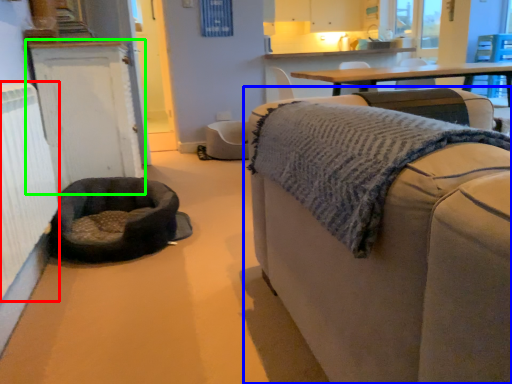
Question: Which is nearer to the radiator (highlighted by a red box)? studio couch (highlighted by a blue box) or cabinetry (highlighted by a green box).

Choices:
 (A) studio couch
 (B) cabinetry

Answer: (B)